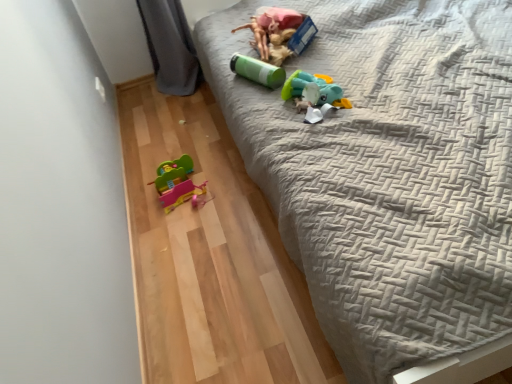
Question: Is gray quilted bed at upper right further to the viewer compared to teal matte plush toy at upper center, which is counted as the second toy, starting from the bottom?

Choices:
 (A) yes
 (B) no

Answer: (B)

Question: Is gray quilted bed at upper right in front of teal matte plush toy at upper center, acting as the third toy starting from the top?

Choices:
 (A) no
 (B) yes

Answer: (B)

Question: Does gray quilted bed at upper right have a smaller size compared to teal matte plush toy at upper center, acting as the third toy starting from the top?

Choices:
 (A) no
 (B) yes

Answer: (A)

Question: Is gray quilted bed at upper right not within teal matte plush toy at upper center, which is counted as the second toy, starting from the bottom?

Choices:
 (A) yes
 (B) no

Answer: (A)

Question: Does gray quilted bed at upper right have a greater height compared to teal matte plush toy at upper center, acting as the third toy starting from the top?

Choices:
 (A) yes
 (B) no

Answer: (A)

Question: Is green matte canister at upper center, which is the third toy from bottom to top, wider or thinner than matte plastic toy car at lower left, marked as the 1th toy in a bottom-to-top arrangement?

Choices:
 (A) wide
 (B) thin

Answer: (A)

Question: Does point (249, 62) appear closer or farther from the camera than point (166, 178)?

Choices:
 (A) farther
 (B) closer

Answer: (B)

Question: Is green matte canister at upper center, which is the third toy from bottom to top, situated inside matte plastic toy car at lower left, marked as the 1th toy in a bottom-to-top arrangement, or outside?

Choices:
 (A) outside
 (B) inside

Answer: (A)

Question: From the image's perspective, is green matte canister at upper center, the second toy in the top-to-bottom sequence, positioned above or below matte plastic toy car at lower left, marked as the 1th toy in a bottom-to-top arrangement?

Choices:
 (A) above
 (B) below

Answer: (A)

Question: Considering the relative positions of gray quilted bed at upper right and matte green plastic cup at upper center, the 4th toy from the bottom, in the image provided, is gray quilted bed at upper right to the left or to the right of matte green plastic cup at upper center, the 4th toy from the bottom,?

Choices:
 (A) left
 (B) right

Answer: (B)

Question: Is gray quilted bed at upper right in front of or behind matte green plastic cup at upper center, which is the first toy in top-to-bottom order, in the image?

Choices:
 (A) behind
 (B) front

Answer: (B)

Question: Looking at their shapes, would you say gray quilted bed at upper right is wider or thinner than matte green plastic cup at upper center, the 4th toy from the bottom?

Choices:
 (A) wide
 (B) thin

Answer: (A)

Question: Does point (476, 266) appear closer or farther from the camera than point (292, 51)?

Choices:
 (A) closer
 (B) farther

Answer: (A)

Question: From the image's perspective, is matte green plastic cup at upper center, which is the first toy in top-to-bottom order, positioned above or below gray quilted bed at upper right?

Choices:
 (A) above
 (B) below

Answer: (A)

Question: From their relative heights in the image, would you say matte green plastic cup at upper center, the 4th toy from the bottom, is taller or shorter than gray quilted bed at upper right?

Choices:
 (A) tall
 (B) short

Answer: (B)